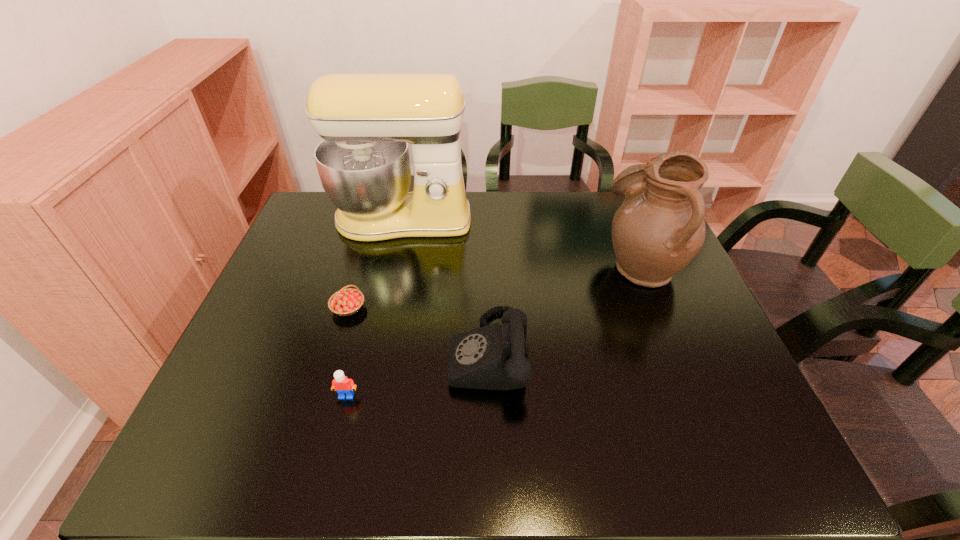
The height and width of the screenshot is (540, 960). Find the location of `vacant area that lies between the second tallest object and the mixer`. vacant area that lies between the second tallest object and the mixer is located at coordinates (522, 242).

You are a GUI agent. You are given a task and a screenshot of the screen. Output one action in this format:
    pyautogui.click(x=<x>, y=<y>)
    Task: Click on the vacant region between the telephone and the Lego
    
    Given the screenshot: What is the action you would take?
    pyautogui.click(x=418, y=374)

Find the location of a particular element. free space between the rightmost object and the telephone is located at coordinates (565, 308).

The height and width of the screenshot is (540, 960). Identify the location of vacant area that lies between the fourth shortest object and the shortest object. 495,286.

What are the coordinates of `the fourth closest object relative to the second tallest object` in the screenshot? It's located at (344, 386).

Locate which object ranks in proximity to the rightmost object. Please provide its 2D coordinates. Your answer should be formatted as a tuple, i.e. [(x, y)], where the tuple contains the x and y coordinates of a point satisfying the conditions above.

[(494, 357)]

The image size is (960, 540). I want to click on vacant space that satisfies the following two spatial constraints: 1. at the spout of the rightmost object; 2. on the face of the fourth tallest object, so click(x=696, y=396).

Locate an element on the screen. vacant space that satisfies the following two spatial constraints: 1. at the spout of the rightmost object; 2. on the front side of the shortest object is located at coordinates (660, 308).